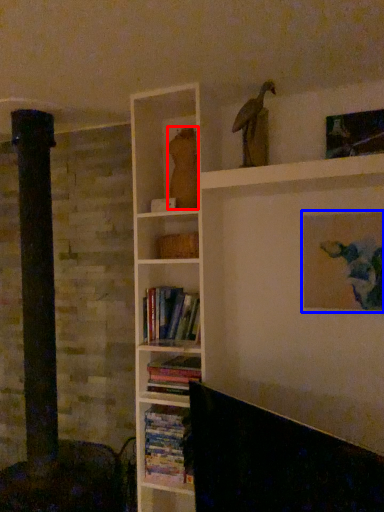
Question: Which of the following is the farthest to the observer, animal (highlighted by a red box) or picture frame (highlighted by a blue box)?

Choices:
 (A) animal
 (B) picture frame

Answer: (A)